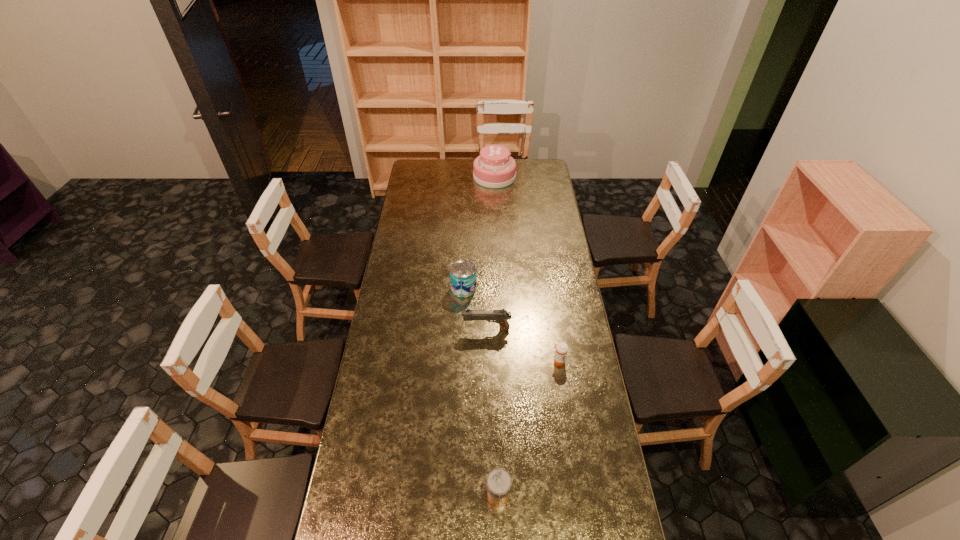
Identify the location of free space located in the direction the third nearest object is aimed. The image size is (960, 540). (396, 329).

The image size is (960, 540). In order to click on vacant space located in the direction the third nearest object is aimed in this screenshot , I will do `click(442, 329)`.

Identify the location of vacant space situated on the back of the fourth nearest object. The width and height of the screenshot is (960, 540). (465, 266).

The width and height of the screenshot is (960, 540). Identify the location of free location located 0.200m on the label side of the nearest object. (x=424, y=496).

Image resolution: width=960 pixels, height=540 pixels. What are the coordinates of `blank space located 0.080m on the label side of the nearest object` in the screenshot? It's located at [462, 496].

At what (x,y) coordinates should I click in order to perform the action: click on vacant area situated 0.060m on the label side of the nearest object. Please return your answer as a coordinate pair (x, y). The height and width of the screenshot is (540, 960). Looking at the image, I should click on (468, 496).

What are the coordinates of `free point located 0.390m on the left of the rightmost object` in the screenshot? It's located at (456, 361).

Identify the location of object located in the far edge section of the desktop. (494, 168).

The height and width of the screenshot is (540, 960). Identify the location of object located in the right edge section of the desktop. (561, 348).

Find the location of `free space at the far edge`. free space at the far edge is located at coordinates (456, 175).